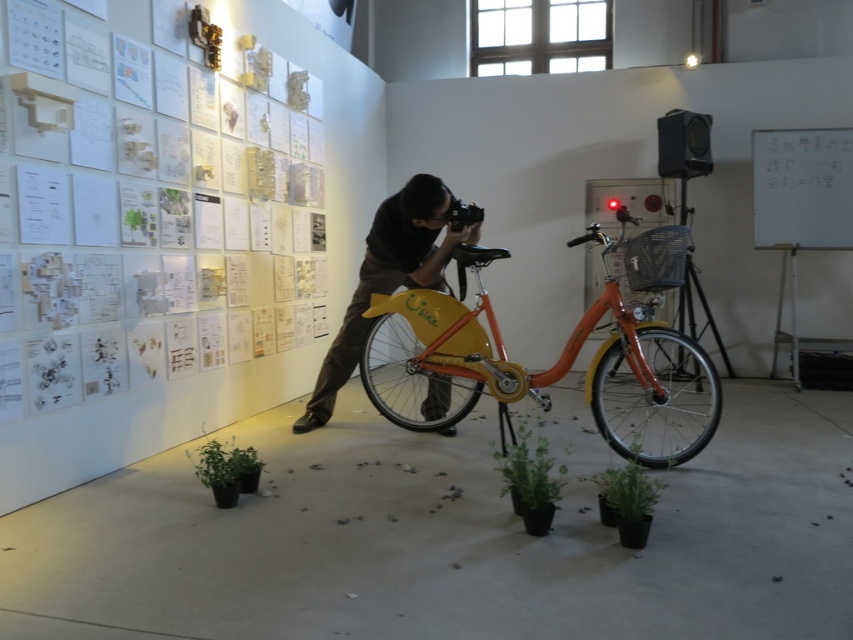
Question: Is matte black camera at center in front of whiteboard at upper right?

Choices:
 (A) no
 (B) yes

Answer: (B)

Question: Among these objects, which one is farthest from the camera?

Choices:
 (A) green matte plant at center
 (B) white paper posters at upper left

Answer: (B)

Question: Which object is farther from the camera taking this photo?

Choices:
 (A) white paper posters at upper left
 (B) matte black camera at center
 (C) green matte plant at lower left

Answer: (B)

Question: Estimate the real-world distances between objects in this image. Which object is farther from the green matte plant at lower left?

Choices:
 (A) white paper posters at upper left
 (B) matte black camera at center
 (C) green matte plant at center

Answer: (A)

Question: Does matte black camera at center lie behind green matte plant at lower center?

Choices:
 (A) no
 (B) yes

Answer: (B)

Question: Is matte black camera at center bigger than green matte plant at lower center?

Choices:
 (A) no
 (B) yes

Answer: (B)